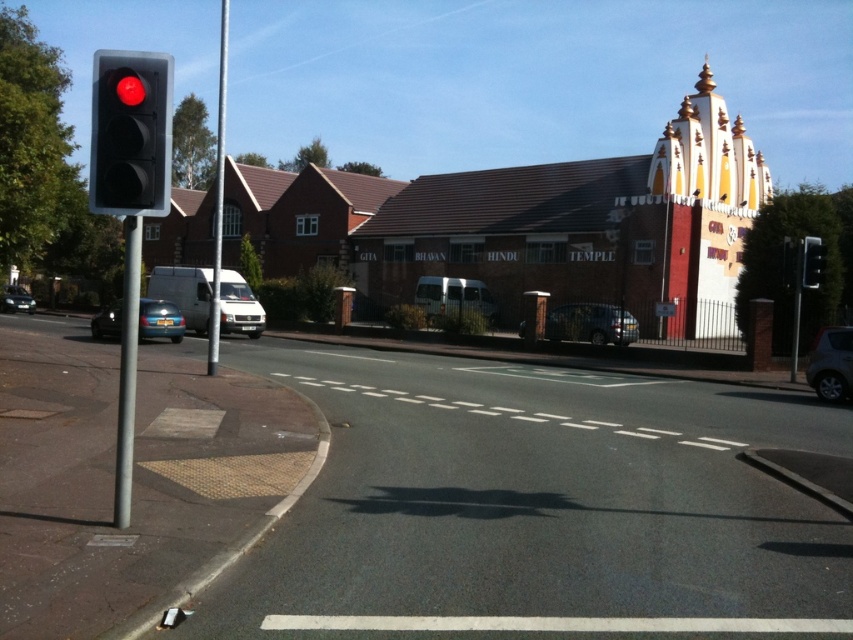
Who is lower down, black plastic traffic light at left or metallic blue car at center?

metallic blue car at center is below.

Is black plastic traffic light at left wider than metallic blue car at center?

No.

Locate an element on the screen. This screenshot has height=640, width=853. black plastic traffic light at left is located at coordinates (131, 132).

Does point (103, 99) lie in front of point (811, 252)?

Yes, it is.

Does black plastic traffic light at left have a larger size compared to black plastic traffic light at right?

Indeed, black plastic traffic light at left has a larger size compared to black plastic traffic light at right.

Where is `black plastic traffic light at left`? This screenshot has width=853, height=640. black plastic traffic light at left is located at coordinates (131, 132).

Can you confirm if metallic silver car at center is wider than satin silver car at lower right?

Yes.

At what (x,y) coordinates should I click in order to perform the action: click on metallic silver car at center. Please return your answer as a coordinate pair (x, y). Looking at the image, I should click on (590, 323).

The width and height of the screenshot is (853, 640). What are the coordinates of `metallic silver car at center` in the screenshot? It's located at (590, 323).